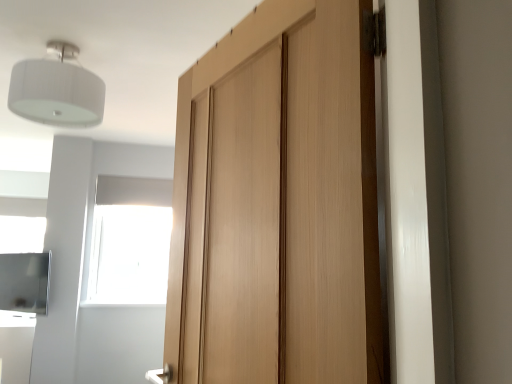
Question: Would you say satin silver cabinet at lower left is a long distance from light wood door at center?

Choices:
 (A) no
 (B) yes

Answer: (B)

Question: Is satin silver cabinet at lower left placed right next to light wood door at center?

Choices:
 (A) no
 (B) yes

Answer: (A)

Question: From a real-world perspective, is satin silver cabinet at lower left positioned under light wood door at center based on gravity?

Choices:
 (A) no
 (B) yes

Answer: (B)

Question: Is satin silver cabinet at lower left looking in the opposite direction of light wood door at center?

Choices:
 (A) yes
 (B) no

Answer: (B)

Question: Could light wood door at center be considered to be inside satin silver cabinet at lower left?

Choices:
 (A) no
 (B) yes

Answer: (A)

Question: Does point (47, 269) appear closer or farther from the camera than point (293, 180)?

Choices:
 (A) closer
 (B) farther

Answer: (B)

Question: From a real-world perspective, is satin silver cabinet at lower left above or below light wood door at center?

Choices:
 (A) above
 (B) below

Answer: (B)

Question: Based on their sizes in the image, would you say satin silver cabinet at lower left is bigger or smaller than light wood door at center?

Choices:
 (A) small
 (B) big

Answer: (A)

Question: Visually, is satin silver cabinet at lower left positioned to the left or to the right of light wood door at center?

Choices:
 (A) left
 (B) right

Answer: (A)

Question: In the image, is light wood door at center positioned in front of or behind transparent glass window at upper center?

Choices:
 (A) front
 (B) behind

Answer: (A)

Question: Is point (295, 380) closer or farther from the camera than point (131, 301)?

Choices:
 (A) closer
 (B) farther

Answer: (A)

Question: From the image's perspective, is light wood door at center positioned above or below transparent glass window at upper center?

Choices:
 (A) below
 (B) above

Answer: (B)

Question: Do you think light wood door at center is within transparent glass window at upper center, or outside of it?

Choices:
 (A) outside
 (B) inside

Answer: (A)

Question: In the image, is white fabric lampshade at upper left on the left side or the right side of satin silver cabinet at lower left?

Choices:
 (A) left
 (B) right

Answer: (B)

Question: From the image's perspective, is white fabric lampshade at upper left positioned above or below satin silver cabinet at lower left?

Choices:
 (A) below
 (B) above

Answer: (B)